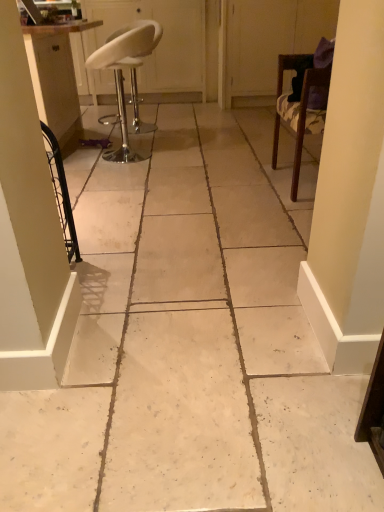
Question: Does white leather stool at upper left, acting as the 2th chair starting from the right, have a smaller size compared to white leather stool at upper left, the 1th screen door viewed from the left?

Choices:
 (A) yes
 (B) no

Answer: (A)

Question: From a real-world perspective, is white leather stool at upper left, placed as the 1th chair when sorted from left to right, located higher than white leather stool at upper left, the 1th screen door viewed from the left?

Choices:
 (A) no
 (B) yes

Answer: (A)

Question: Is white leather stool at upper left, placed as the 1th chair when sorted from left to right, positioned behind white leather stool at upper left, the 2th screen door in the right-to-left sequence?

Choices:
 (A) yes
 (B) no

Answer: (B)

Question: Does white leather stool at upper left, acting as the 2th chair starting from the right, have a larger size compared to white leather stool at upper left, the 2th screen door in the right-to-left sequence?

Choices:
 (A) yes
 (B) no

Answer: (B)

Question: From the image's perspective, is white leather stool at upper left, placed as the 1th chair when sorted from left to right, located beneath white leather stool at upper left, the 2th screen door in the right-to-left sequence?

Choices:
 (A) no
 (B) yes

Answer: (B)

Question: Is white leather stool at upper left, acting as the 2th chair starting from the right, aimed at white leather stool at upper left, the 1th screen door viewed from the left?

Choices:
 (A) yes
 (B) no

Answer: (B)

Question: Is white leather stool at upper left, the 2th screen door in the right-to-left sequence, to the left of white leather stool at upper left, acting as the 2th chair starting from the right, from the viewer's perspective?

Choices:
 (A) no
 (B) yes

Answer: (B)

Question: Can you confirm if white leather stool at upper left, the 1th screen door viewed from the left, is bigger than white leather stool at upper left, acting as the 2th chair starting from the right?

Choices:
 (A) no
 (B) yes

Answer: (B)

Question: Is white leather stool at upper left, the 1th screen door viewed from the left, wider than white leather stool at upper left, placed as the 1th chair when sorted from left to right?

Choices:
 (A) no
 (B) yes

Answer: (B)

Question: Is white leather stool at upper left, the 2th screen door in the right-to-left sequence, closer to the viewer compared to white leather stool at upper left, placed as the 1th chair when sorted from left to right?

Choices:
 (A) yes
 (B) no

Answer: (B)

Question: From the image's perspective, would you say white leather stool at upper left, the 1th screen door viewed from the left, is shown under white leather stool at upper left, acting as the 2th chair starting from the right?

Choices:
 (A) yes
 (B) no

Answer: (B)

Question: From a real-world perspective, is white leather stool at upper left, the 1th screen door viewed from the left, physically below white leather stool at upper left, placed as the 1th chair when sorted from left to right?

Choices:
 (A) no
 (B) yes

Answer: (A)

Question: Considering the relative sizes of transparent plastic screen door at upper right, the 1th screen door positioned from the right, and white leather stool at upper left, the 2th screen door in the right-to-left sequence, in the image provided, is transparent plastic screen door at upper right, the 1th screen door positioned from the right, taller than white leather stool at upper left, the 2th screen door in the right-to-left sequence,?

Choices:
 (A) no
 (B) yes

Answer: (A)